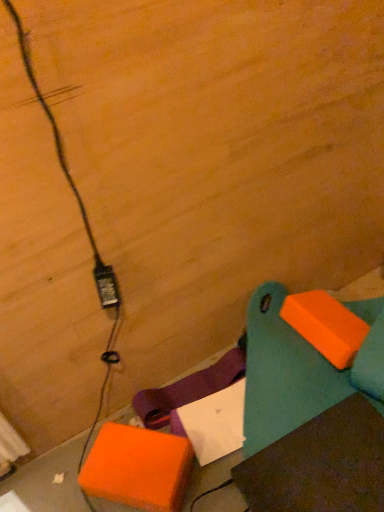
Question: Considering the relative positions of teal plastic bench at lower right and black plastic power plug at lower left in the image provided, is teal plastic bench at lower right to the left or to the right of black plastic power plug at lower left?

Choices:
 (A) left
 (B) right

Answer: (B)

Question: Considering the positions of point (374, 318) and point (94, 274), is point (374, 318) closer or farther from the camera than point (94, 274)?

Choices:
 (A) closer
 (B) farther

Answer: (B)

Question: Considering the real-world distances, which object is farthest from the teal plastic bench at lower right?

Choices:
 (A) orange matte cardboard box at lower left
 (B) black plastic power plug at lower left

Answer: (B)

Question: Which is farther from the orange matte cardboard box at lower left?

Choices:
 (A) teal plastic bench at lower right
 (B) black plastic power plug at lower left

Answer: (B)